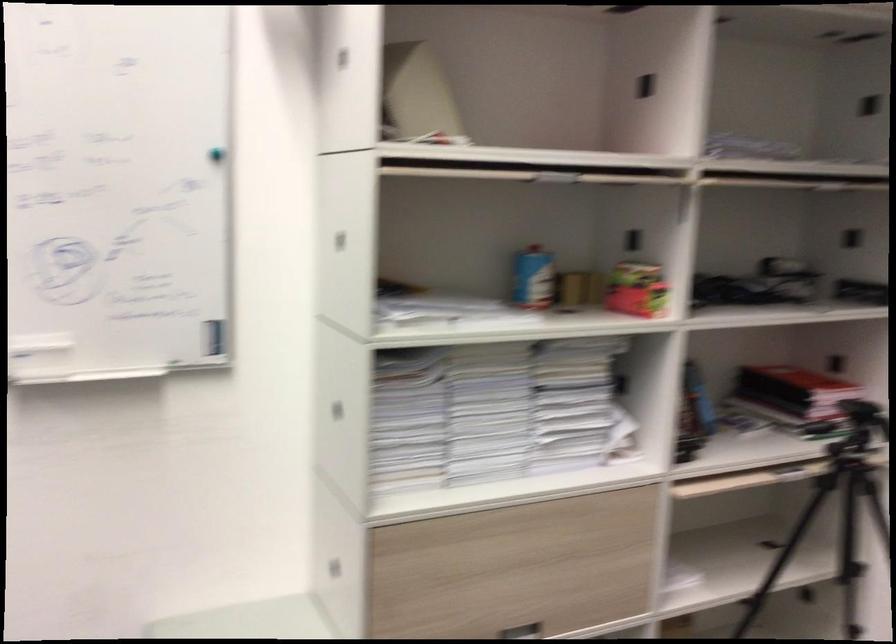
At what (x,y) coordinates should I click in order to perform the action: click on pink patterned box. Please return your answer as a coordinate pair (x, y). The height and width of the screenshot is (644, 896). Looking at the image, I should click on (636, 289).